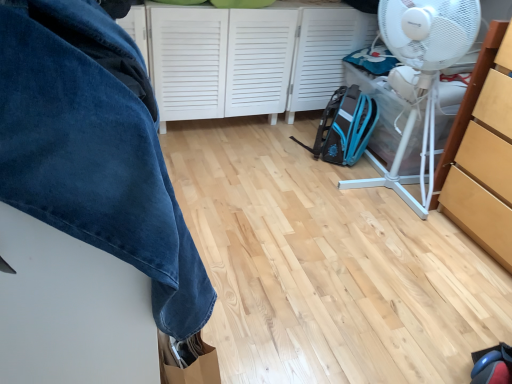
Question: From a real-world perspective, is teal fabric backpack at center-right above or below white matte cabinet at center, which ranks as the second cabinetry in front-to-back order?

Choices:
 (A) above
 (B) below

Answer: (B)

Question: Considering the relative positions of teal fabric backpack at center-right and white matte cabinet at center, which ranks as the second cabinetry in front-to-back order, in the image provided, is teal fabric backpack at center-right to the left or to the right of white matte cabinet at center, which ranks as the second cabinetry in front-to-back order,?

Choices:
 (A) right
 (B) left

Answer: (A)

Question: Which object is the farthest from the velvety blue blanket at upper left?

Choices:
 (A) teal fabric backpack at center-right
 (B) light wood cabinet at right, acting as the second cabinetry starting from the left
 (C) white matte cabinet at center, which ranks as the second cabinetry in front-to-back order
 (D) white plastic mechanical fan at right

Answer: (A)

Question: Considering the real-world distances, which object is farthest from the velvety blue blanket at upper left?

Choices:
 (A) light wood cabinet at right, acting as the second cabinetry starting from the left
 (B) teal fabric backpack at center-right
 (C) white plastic mechanical fan at right
 (D) white matte cabinet at center, which ranks as the second cabinetry in front-to-back order

Answer: (B)